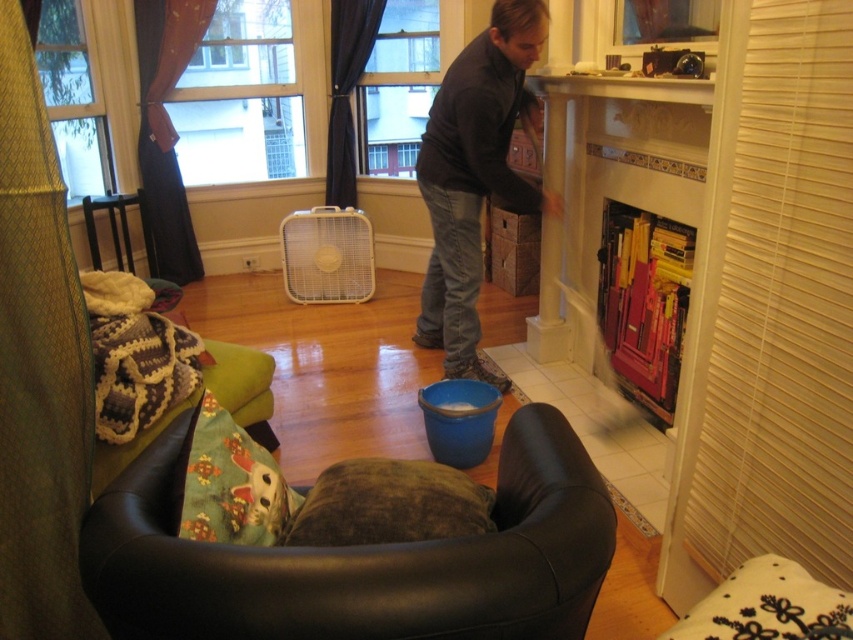
Question: Does brown suede bean bag at lower center appear on the right side of dark gray sweater at center?

Choices:
 (A) no
 (B) yes

Answer: (A)

Question: Does brown suede bean bag at lower center have a lesser width compared to dark gray sweater at center?

Choices:
 (A) yes
 (B) no

Answer: (B)

Question: Which of the following is the closest to the observer?

Choices:
 (A) dark gray sweater at center
 (B) brown suede bean bag at lower center

Answer: (B)

Question: Does brown suede bean bag at lower center have a larger size compared to dark gray sweater at center?

Choices:
 (A) no
 (B) yes

Answer: (A)